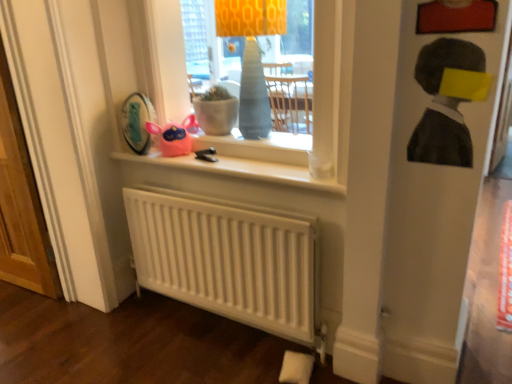
Question: Should I look upward or downward to see white matte window sill at upper center?

Choices:
 (A) up
 (B) down

Answer: (A)

Question: Is matte gray vase at center located outside charcoal sketch portrait at upper right?

Choices:
 (A) yes
 (B) no

Answer: (A)

Question: Would you say matte gray vase at center contains charcoal sketch portrait at upper right?

Choices:
 (A) no
 (B) yes

Answer: (A)

Question: From a real-world perspective, is matte gray vase at center positioned under charcoal sketch portrait at upper right based on gravity?

Choices:
 (A) no
 (B) yes

Answer: (A)

Question: Is matte gray vase at center far from charcoal sketch portrait at upper right?

Choices:
 (A) yes
 (B) no

Answer: (B)

Question: Does matte gray vase at center lie in front of charcoal sketch portrait at upper right?

Choices:
 (A) yes
 (B) no

Answer: (B)

Question: Does matte gray vase at center have a lesser height compared to charcoal sketch portrait at upper right?

Choices:
 (A) no
 (B) yes

Answer: (A)

Question: Does white matte radiator at lower center have a greater width compared to white matte window sill at upper center?

Choices:
 (A) no
 (B) yes

Answer: (A)

Question: Is white matte radiator at lower center smaller than white matte window sill at upper center?

Choices:
 (A) no
 (B) yes

Answer: (A)

Question: From the image's perspective, would you say white matte radiator at lower center is shown under white matte window sill at upper center?

Choices:
 (A) no
 (B) yes

Answer: (B)

Question: Is white matte radiator at lower center taller than white matte window sill at upper center?

Choices:
 (A) yes
 (B) no

Answer: (A)

Question: Is white matte radiator at lower center at the left side of white matte window sill at upper center?

Choices:
 (A) yes
 (B) no

Answer: (A)

Question: Does white matte radiator at lower center have a lesser height compared to white matte window sill at upper center?

Choices:
 (A) no
 (B) yes

Answer: (A)

Question: Is white wooden screen door at left completely or partially inside matte gray vase at center?

Choices:
 (A) yes
 (B) no

Answer: (B)